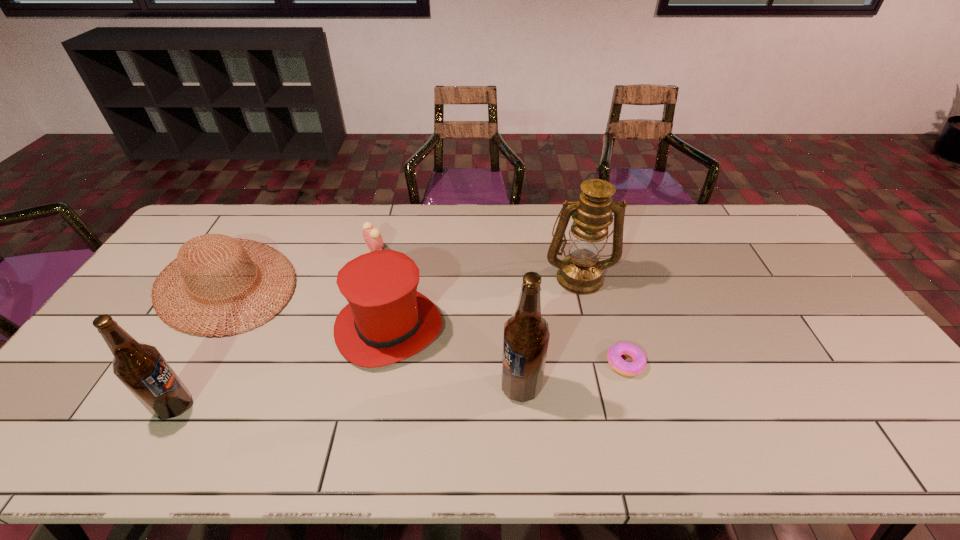
Where is `vacant space located 0.070m on the label of the right beer bottle`? This screenshot has height=540, width=960. vacant space located 0.070m on the label of the right beer bottle is located at coordinates (473, 387).

Find the location of `vacant space situated 0.160m on the label of the right beer bottle`. vacant space situated 0.160m on the label of the right beer bottle is located at coordinates pyautogui.click(x=437, y=387).

The height and width of the screenshot is (540, 960). What are the coordinates of `vacant space located on the face of the alarm clock` in the screenshot? It's located at (434, 249).

Where is `vacant space located on the front of the oil lamp`? This screenshot has height=540, width=960. vacant space located on the front of the oil lamp is located at coordinates (591, 325).

Identify the location of free space located on the right of the sunhat. Image resolution: width=960 pixels, height=540 pixels. (420, 284).

Where is `free space located 0.100m on the front of the fourth tallest object`? This screenshot has width=960, height=540. free space located 0.100m on the front of the fourth tallest object is located at coordinates (373, 407).

Find the location of a particular element. vacant space located on the back of the doughnut is located at coordinates (608, 302).

This screenshot has height=540, width=960. What are the coordinates of `alarm clock present at the far edge` in the screenshot? It's located at (372, 236).

Locate an element on the screen. The width and height of the screenshot is (960, 540). sunhat that is at the far edge is located at coordinates (195, 254).

At what (x,y) coordinates should I click in order to perform the action: click on object present at the left edge. Please return your answer as a coordinate pair (x, y). The image size is (960, 540). Looking at the image, I should click on (195, 254).